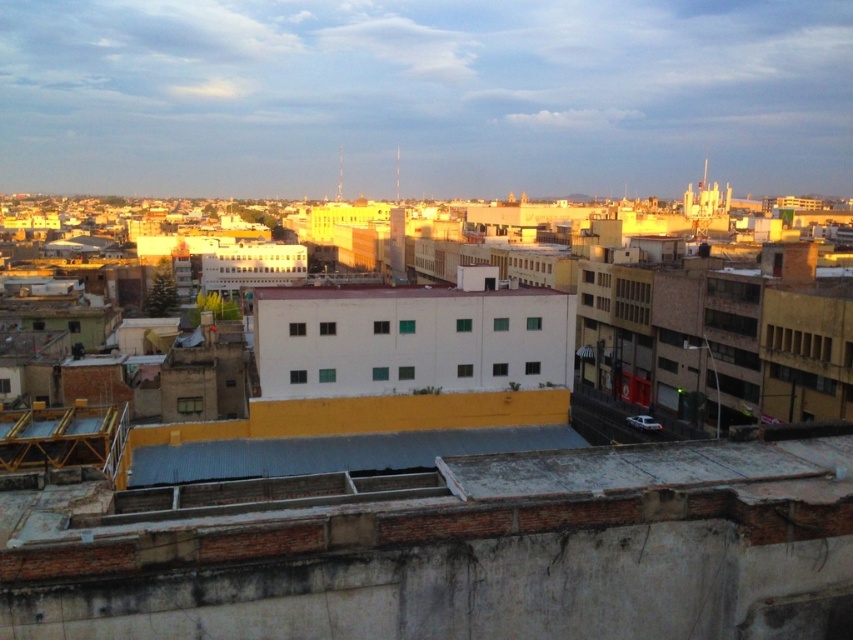
Question: Can you confirm if gray corrugated metal roof at lower right is positioned to the left of gray corrugated metal roof at center?

Choices:
 (A) yes
 (B) no

Answer: (B)

Question: Does gray corrugated metal roof at lower right appear on the right side of gray corrugated metal roof at center?

Choices:
 (A) no
 (B) yes

Answer: (B)

Question: Which object is farther from the camera taking this photo?

Choices:
 (A) gray corrugated metal roof at center
 (B) gray corrugated metal roof at lower right

Answer: (A)

Question: Which point is closer to the camera taking this photo?

Choices:
 (A) (329, 464)
 (B) (447, 468)

Answer: (B)

Question: Does gray corrugated metal roof at lower right appear over gray corrugated metal roof at center?

Choices:
 (A) yes
 (B) no

Answer: (A)